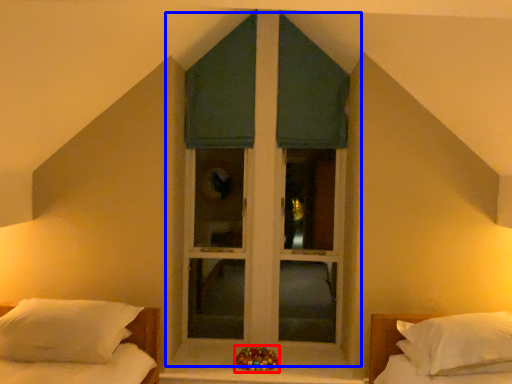
Question: Among these objects, which one is nearest to the camera, miniature (highlighted by a red box) or window (highlighted by a blue box)?

Choices:
 (A) miniature
 (B) window

Answer: (A)